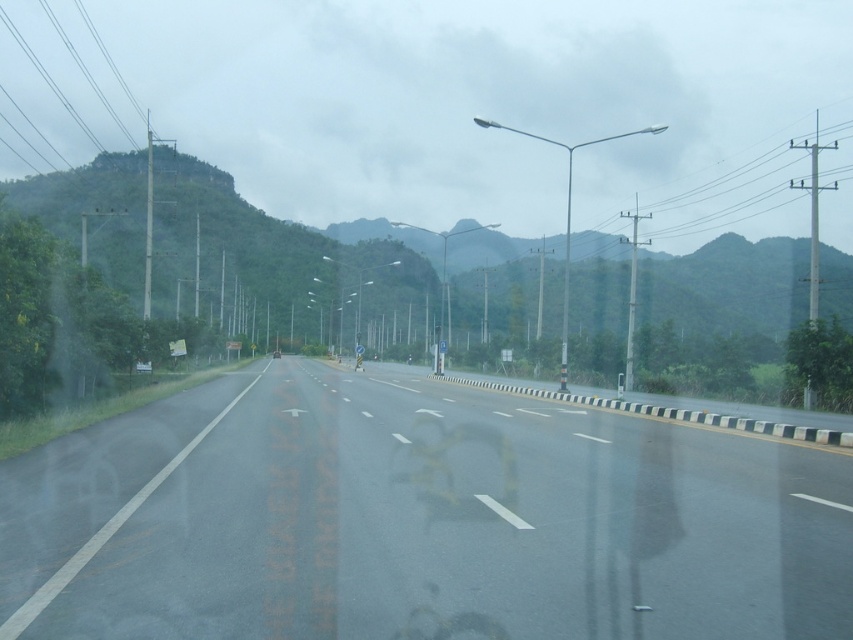
Who is more forward, (762, 451) or (136, 205)?

Point (762, 451) is in front.

Between asphalt road at center and green textured mountain at left, which one appears on the right side from the viewer's perspective?

Positioned to the right is green textured mountain at left.

The height and width of the screenshot is (640, 853). What do you see at coordinates (416, 522) in the screenshot? I see `asphalt road at center` at bounding box center [416, 522].

Where is `asphalt road at center`? asphalt road at center is located at coordinates (416, 522).